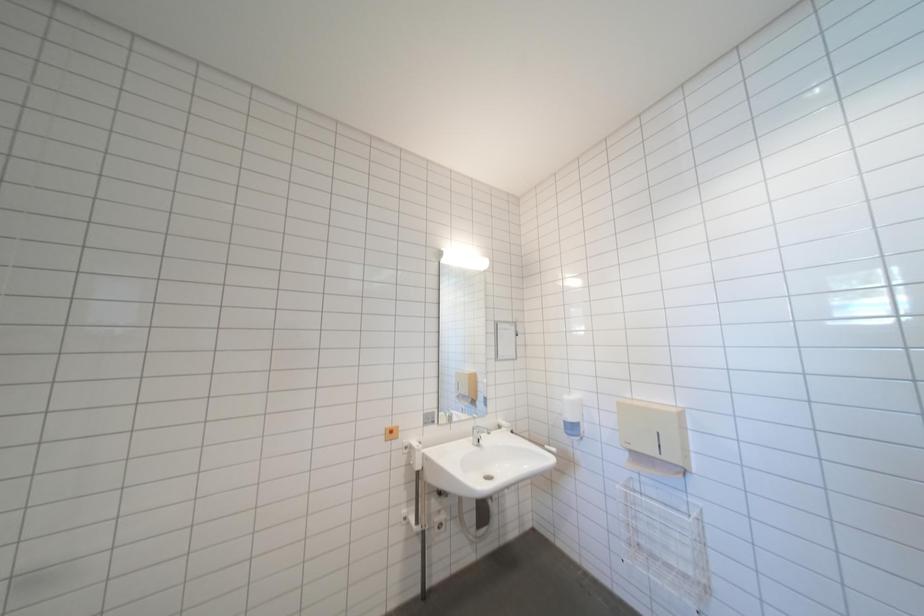
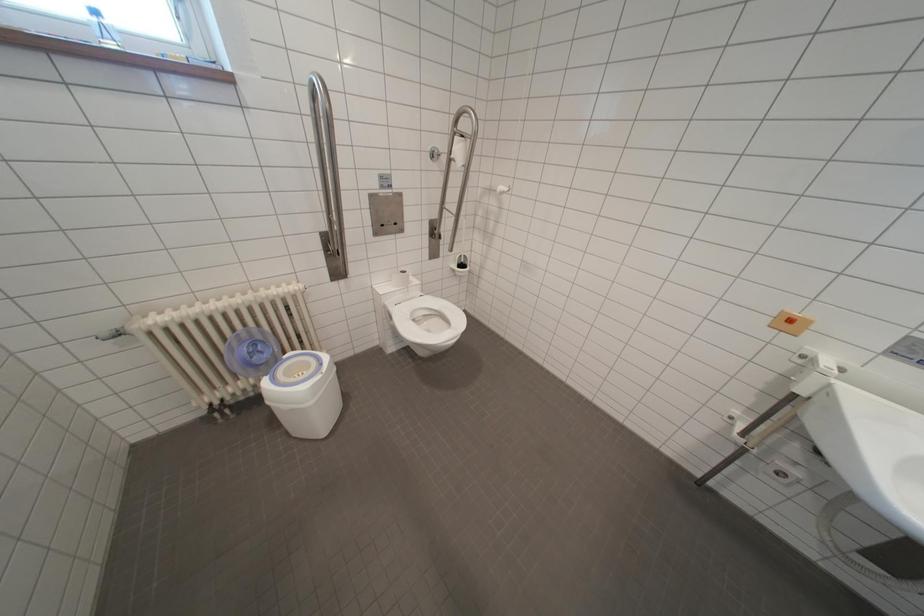
The first image is from the beginning of the video and the second image is from the end. How did the camera likely rotate when shooting the video?

The rotation direction of the camera is left-down.